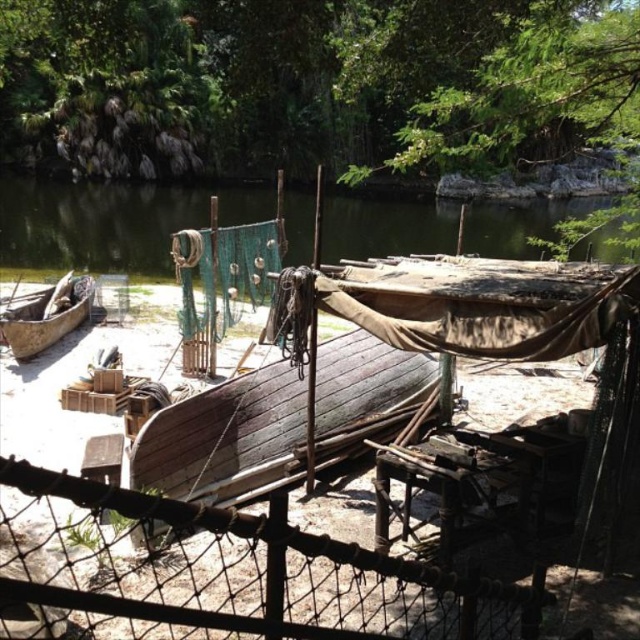
Question: Which point is closer to the camera?

Choices:
 (A) wire mesh fence at center
 (B) rusty wire mesh at center
 (C) brown wooden canoe at left

Answer: (A)

Question: Can you confirm if rusty wire mesh at center is positioned above dark brown wooden boat at center?

Choices:
 (A) no
 (B) yes

Answer: (A)

Question: Based on their relative distances, which object is farther from the rusty wire mesh at center?

Choices:
 (A) brown wooden canoe at left
 (B) wire mesh fence at center

Answer: (A)

Question: Estimate the real-world distances between objects in this image. Which object is closer to the rusty wire mesh at center?

Choices:
 (A) brown wooden canoe at left
 (B) dark brown wooden boat at center
 (C) wire mesh fence at center

Answer: (B)

Question: Does dark brown wooden boat at center come behind brown wooden canoe at left?

Choices:
 (A) no
 (B) yes

Answer: (A)

Question: In this image, where is wire mesh fence at center located relative to brown wooden canoe at left?

Choices:
 (A) above
 (B) below

Answer: (B)